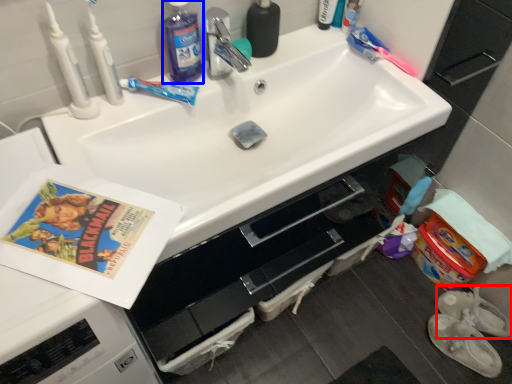
Question: Which of the following is the closest to the observer, footwear (highlighted by a red box) or cleaning product (highlighted by a blue box)?

Choices:
 (A) footwear
 (B) cleaning product

Answer: (B)